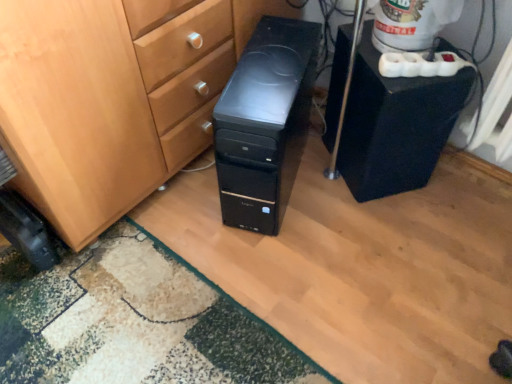
Find the location of `vacant area that lies in front of black plastic computer tower at center`. vacant area that lies in front of black plastic computer tower at center is located at coordinates (282, 271).